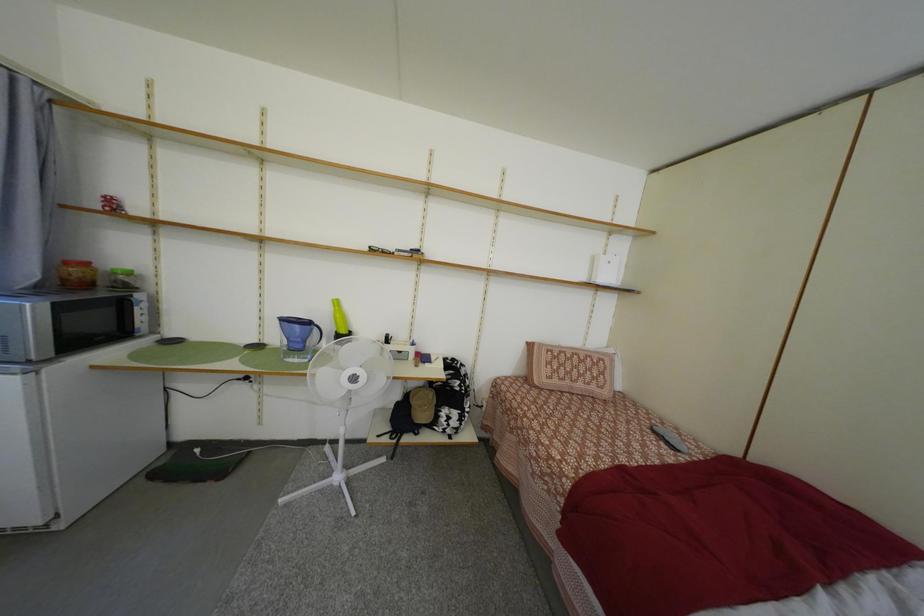
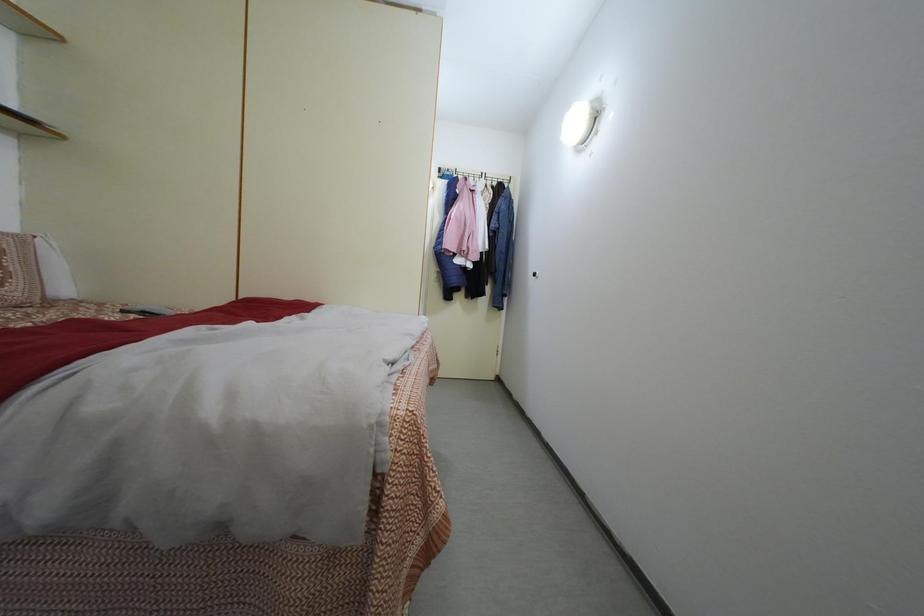
Question: The camera is either moving clockwise (left) or counter-clockwise (right) around the object. The first image is from the beginning of the video and the second image is from the end. Is the camera moving left or right when shooting the video?

Choices:
 (A) Left
 (B) Right

Answer: (A)